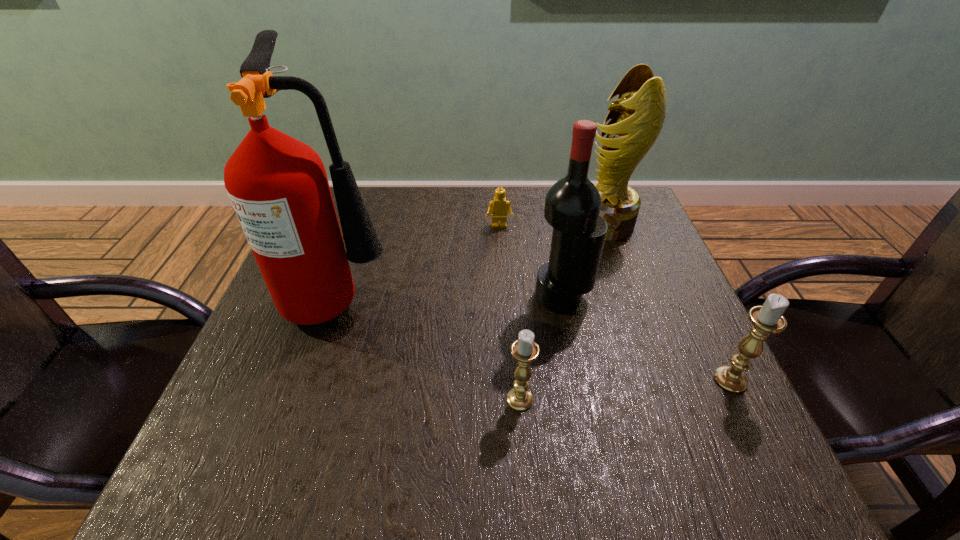
Image resolution: width=960 pixels, height=540 pixels. Identify the location of free region located on the back of the third shortest object. (672, 264).

Locate an element on the screen. This screenshot has height=540, width=960. free location located 0.380m on the face of the shortest object is located at coordinates (506, 345).

You are a GUI agent. You are given a task and a screenshot of the screen. Output one action in this format:
    pyautogui.click(x=<x>, y=<y>)
    Task: Click on the free spot located 0.330m on the front-facing side of the fifth object from left to right
    
    Given the screenshot: What is the action you would take?
    (453, 224)

Locate an element on the screen. free space located 0.090m on the front-facing side of the fifth object from left to right is located at coordinates (543, 224).

At what (x,y) coordinates should I click in order to perform the action: click on free space located 0.210m on the front-facing side of the fifth object from left to right. Please return your answer as a coordinate pair (x, y). This screenshot has width=960, height=540. Looking at the image, I should click on (498, 224).

Identify the location of vacant space located 0.310m at the nozzle of the leftmost object. The width and height of the screenshot is (960, 540). (535, 297).

Locate an element on the screen. The image size is (960, 540). free space located 0.080m on the left of the wine bottle is located at coordinates (498, 297).

You are a GUI agent. You are given a task and a screenshot of the screen. Output one action in this format:
    pyautogui.click(x=<x>, y=<y>)
    Task: Click on the Lego present at the far edge
    
    Given the screenshot: What is the action you would take?
    coord(498,207)

Identify the location of award located in the far edge section of the desktop. The height and width of the screenshot is (540, 960). (637, 116).

You are a GUI agent. You are given a task and a screenshot of the screen. Output one action in this format:
    pyautogui.click(x=<x>, y=<y>)
    Task: Click on the object that is at the left edge
    Image resolution: width=960 pixels, height=540 pixels.
    Given the screenshot: What is the action you would take?
    pyautogui.click(x=278, y=186)